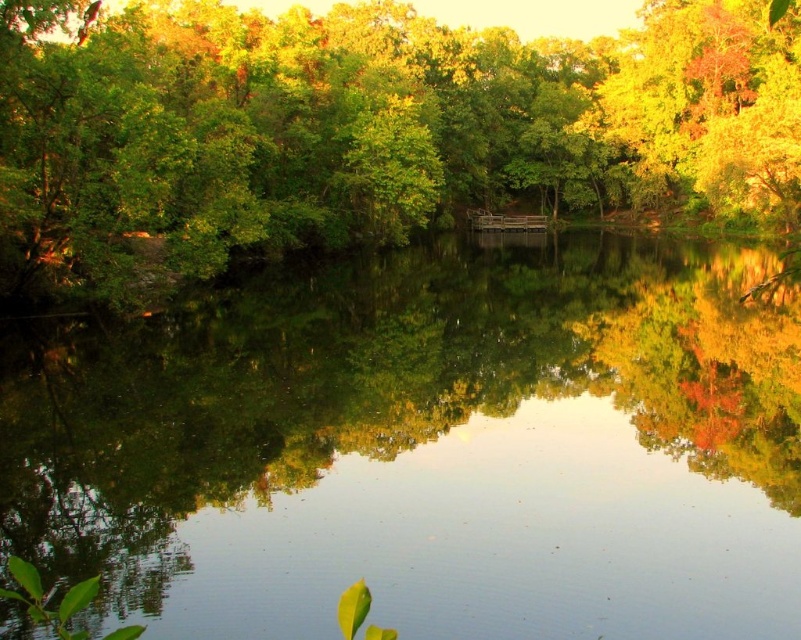
Question: Can you confirm if clear water at center is positioned to the left of green leafy tree at center?

Choices:
 (A) yes
 (B) no

Answer: (A)

Question: Does clear water at center appear under green leafy tree at center?

Choices:
 (A) yes
 (B) no

Answer: (A)

Question: Which object is closer to the camera taking this photo?

Choices:
 (A) green leafy tree at center
 (B) clear water at center

Answer: (A)

Question: Is clear water at center to the right of green leafy tree at center from the viewer's perspective?

Choices:
 (A) no
 (B) yes

Answer: (A)

Question: Which point appears farthest from the camera in this image?

Choices:
 (A) (280, 394)
 (B) (403, 120)

Answer: (B)